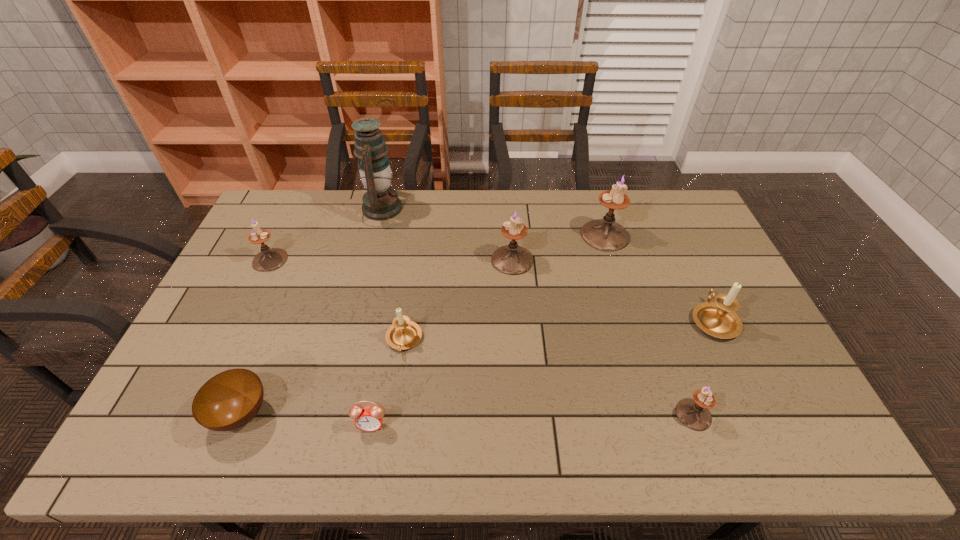
Locate an element on the screen. The image size is (960, 540). vacant space located with a handle on the side of the bigger beige candle holder is located at coordinates (672, 231).

Find the location of a particular element. The image size is (960, 540). free space located 0.100m with a handle on the side of the bigger beige candle holder is located at coordinates (693, 275).

Where is `free location located with a handle on the side of the bigger beige candle holder`? The height and width of the screenshot is (540, 960). free location located with a handle on the side of the bigger beige candle holder is located at coordinates [686, 262].

Where is `vacant area located with a handle on the side of the smaller beige candle holder`? This screenshot has width=960, height=540. vacant area located with a handle on the side of the smaller beige candle holder is located at coordinates (390, 438).

This screenshot has height=540, width=960. Identify the location of free space located on the left of the smallest purple candle holder. 638,415.

Find the location of a particular element. free space located 0.270m on the back of the shortest object is located at coordinates (285, 306).

You are a GUI agent. You are given a task and a screenshot of the screen. Output one action in this format:
    pyautogui.click(x=<x>, y=<y>)
    Task: Click on the oil lamp that is positioned at the far edge
    Image resolution: width=960 pixels, height=540 pixels.
    Given the screenshot: What is the action you would take?
    pyautogui.click(x=380, y=202)

You are a GUI agent. You are given a task and a screenshot of the screen. Output one action in this format:
    pyautogui.click(x=<x>, y=<y>)
    Task: Click on the candle holder that is at the far edge
    The image size is (960, 540).
    Given the screenshot: What is the action you would take?
    pyautogui.click(x=605, y=234)

Locate an element on the screen. This screenshot has width=960, height=540. candle holder present at the near edge is located at coordinates (693, 413).

This screenshot has width=960, height=540. In order to click on alarm clock present at the near edge in this screenshot , I will do pos(369,418).